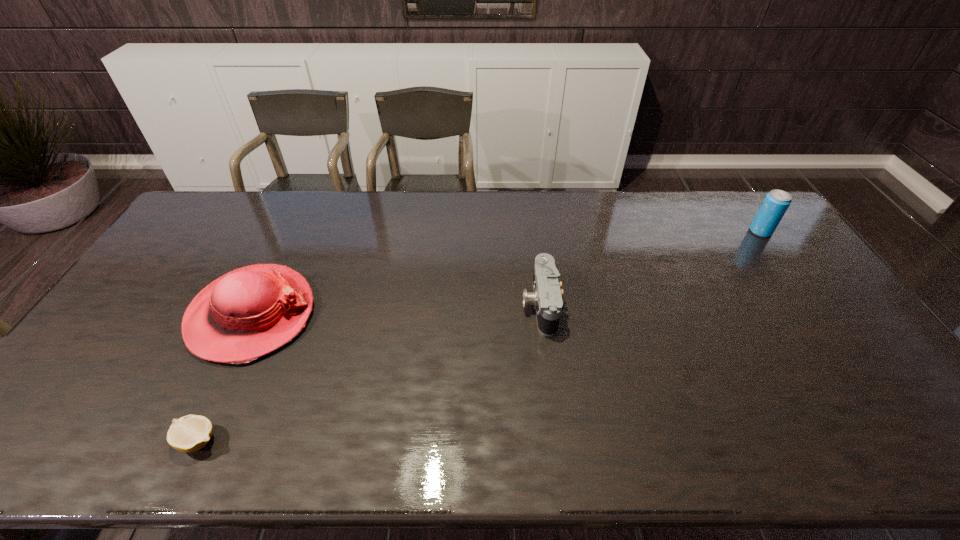
Locate an element on the screen. The height and width of the screenshot is (540, 960). free spot at the right edge of the desktop is located at coordinates (837, 340).

Locate an element on the screen. This screenshot has width=960, height=540. blank region between the hat and the farthest object is located at coordinates (x=506, y=273).

This screenshot has width=960, height=540. Find the location of `vacant area that lies between the soda can and the lemon`. vacant area that lies between the soda can and the lemon is located at coordinates (479, 336).

What are the coordinates of `free point between the hat and the farthest object` in the screenshot? It's located at (506, 273).

Find the location of a particular element. The width and height of the screenshot is (960, 540). vacant space that's between the hat and the rightmost object is located at coordinates click(506, 273).

The height and width of the screenshot is (540, 960). What are the coordinates of `blank region between the hat and the soda can` in the screenshot? It's located at (506, 273).

Identify the location of free space between the rightmost object and the hat. The width and height of the screenshot is (960, 540). (506, 273).

Find the location of `free space that is in between the hat and the rightmost object`. free space that is in between the hat and the rightmost object is located at coordinates (506, 273).

Image resolution: width=960 pixels, height=540 pixels. I want to click on vacant point located between the farthest object and the camera, so click(x=650, y=268).

Identify the location of vacant space in between the soda can and the nearest object. The height and width of the screenshot is (540, 960). (479, 336).